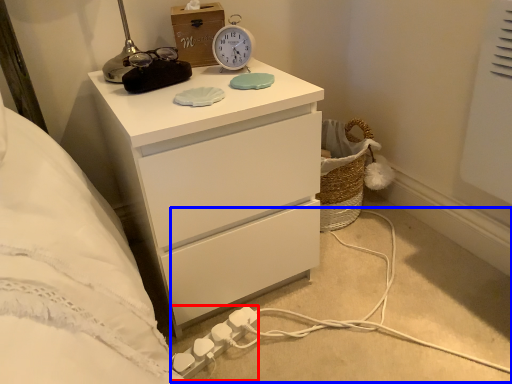
Question: Which object is further to the camera taking this photo, extension cord (highlighted by a red box) or cable (highlighted by a blue box)?

Choices:
 (A) extension cord
 (B) cable

Answer: (A)